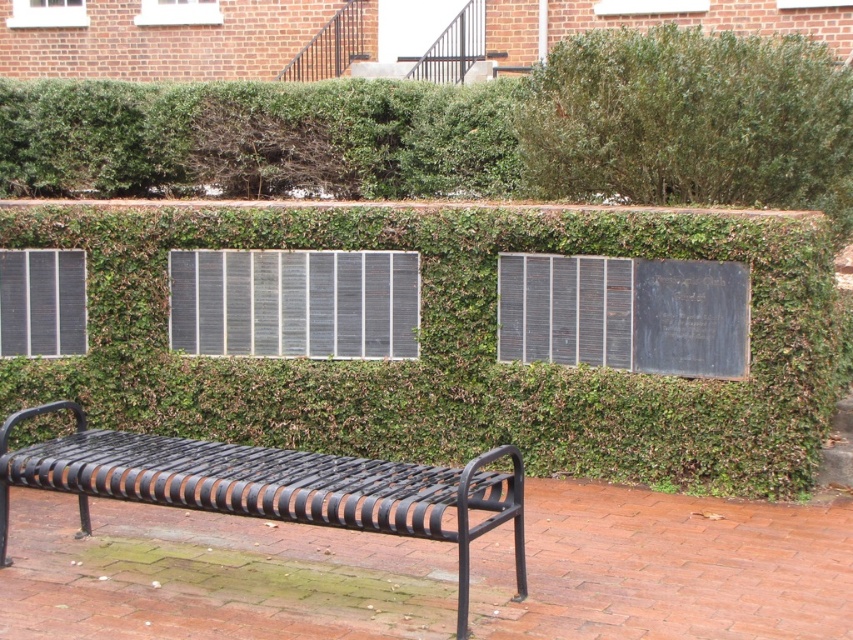
Between black metal bench at lower left and metallic grid panel at left, which one has more height?

With more height is black metal bench at lower left.

Is black metal bench at lower left smaller than metallic grid panel at left?

Incorrect, black metal bench at lower left is not smaller in size than metallic grid panel at left.

Identify the location of black metal bench at lower left. (270, 484).

Find the location of a particular element. The width and height of the screenshot is (853, 640). black metal bench at lower left is located at coordinates (270, 484).

Does point (494, 380) lie in front of point (764, 132)?

Yes, point (494, 380) is in front of point (764, 132).

Is green leafy hedge at center smaller than green leafy hedge at upper right?

Correct, green leafy hedge at center occupies less space than green leafy hedge at upper right.

Locate an element on the screen. The height and width of the screenshot is (640, 853). green leafy hedge at center is located at coordinates (451, 346).

Is green leafy hedge at center further to the viewer compared to black metal bench at lower left?

That is True.

Consider the image. Is green leafy hedge at center bigger than black metal bench at lower left?

Indeed, green leafy hedge at center has a larger size compared to black metal bench at lower left.

At what (x,y) coordinates should I click in order to perform the action: click on green leafy hedge at center. Please return your answer as a coordinate pair (x, y). The width and height of the screenshot is (853, 640). Looking at the image, I should click on (451, 346).

I want to click on green leafy hedge at center, so click(451, 346).